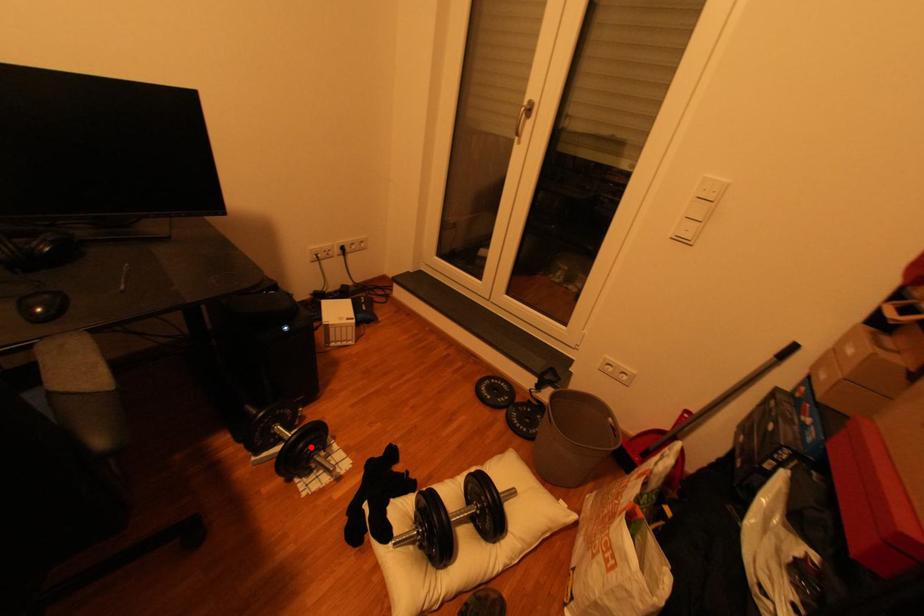
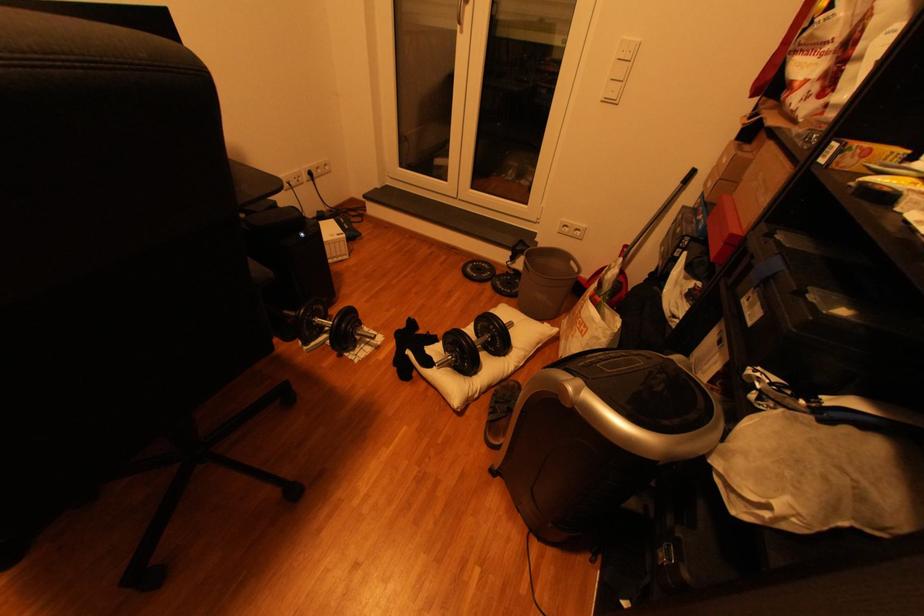
Question: I am providing you with two images of the same scene from different viewpoints. A red point is shown in image1. For the corresponding object point in image2, is it positioned nearer or farther from the camera?

Choices:
 (A) Nearer
 (B) Farther

Answer: (A)